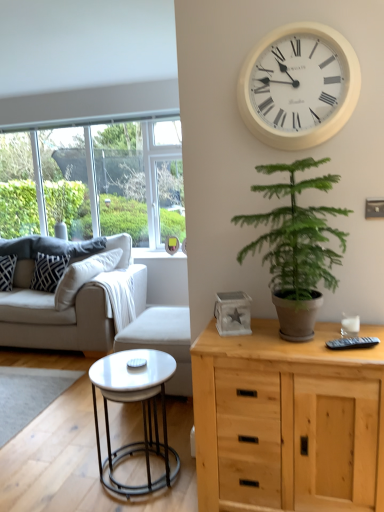
Where is `unoccupied area in front of black plastic remote at right`? The height and width of the screenshot is (512, 384). unoccupied area in front of black plastic remote at right is located at coordinates (361, 356).